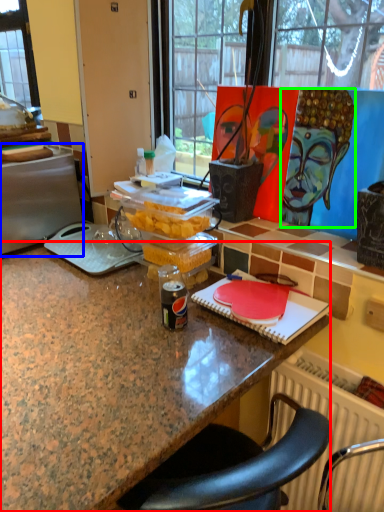
Question: Estimate the real-world distances between objects in this image. Which object is farther from desk (highlighted by a red box), appliance (highlighted by a blue box) or person (highlighted by a green box)?

Choices:
 (A) appliance
 (B) person

Answer: (B)